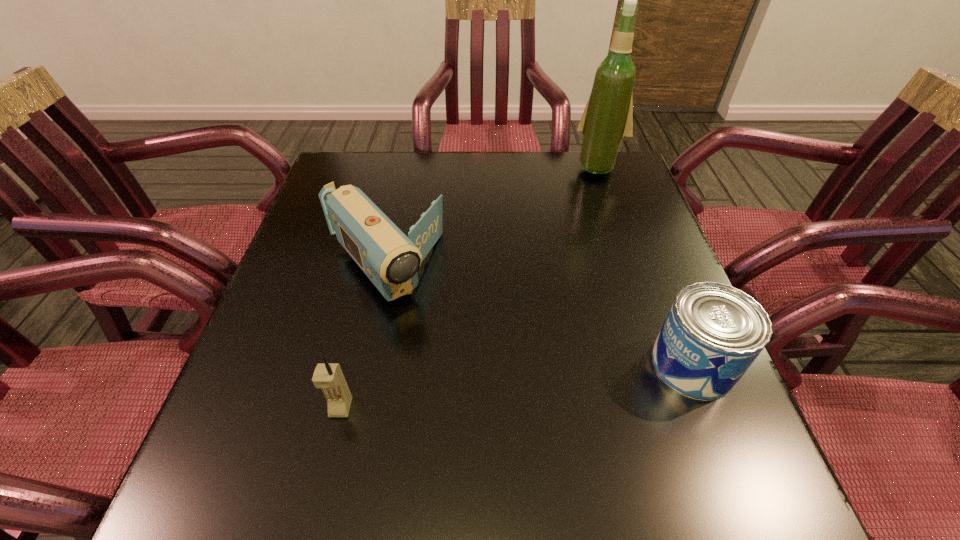
Identify the location of object that is at the far right corner. Image resolution: width=960 pixels, height=540 pixels. click(607, 121).

The image size is (960, 540). I want to click on object that is at the near right corner, so click(713, 332).

Find the location of a particular element. vacant space at the far edge of the desktop is located at coordinates (404, 158).

At what (x,y) coordinates should I click in order to perform the action: click on free region at the near edge. Please return your answer as a coordinate pair (x, y). Looking at the image, I should click on (433, 418).

In the image, there is a desktop. Where is `vacant space at the left edge`? This screenshot has width=960, height=540. vacant space at the left edge is located at coordinates (266, 362).

Locate an element on the screen. vacant position at the right edge of the desktop is located at coordinates (652, 259).

Locate an element on the screen. The height and width of the screenshot is (540, 960). free space at the far left corner of the desktop is located at coordinates (321, 186).

In the image, there is a desktop. At what (x,y) coordinates should I click in order to perform the action: click on vacant space at the near left corner. Please return your answer as a coordinate pair (x, y). The image size is (960, 540). Looking at the image, I should click on (239, 441).

This screenshot has height=540, width=960. In the image, there is a desktop. Identify the location of vacant space at the far right corner. (636, 184).

In the image, there is a desktop. In order to click on vacant space at the near right corner in this screenshot , I will do `click(728, 418)`.